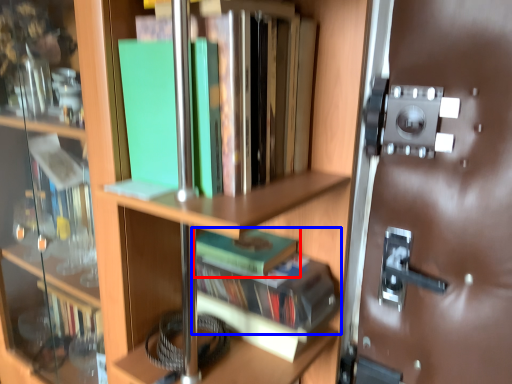
Question: Which object is further to the camera taking this photo, book (highlighted by a red box) or book (highlighted by a blue box)?

Choices:
 (A) book
 (B) book

Answer: (A)